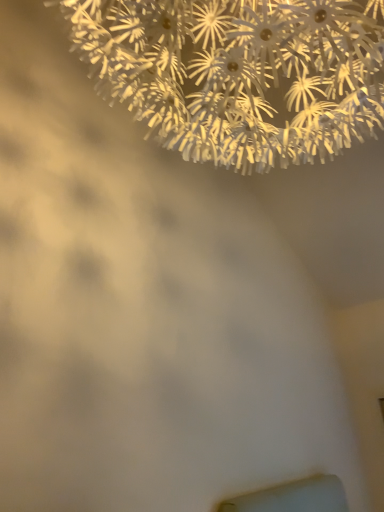
The height and width of the screenshot is (512, 384). Describe the element at coordinates (239, 73) in the screenshot. I see `white paper flower at upper center` at that location.

Where is `white paper flower at upper center`? The height and width of the screenshot is (512, 384). white paper flower at upper center is located at coordinates (239, 73).

Locate an element on the screen. This screenshot has height=512, width=384. white paper flower at upper center is located at coordinates (239, 73).